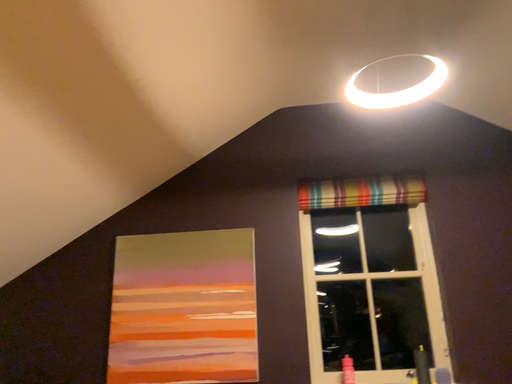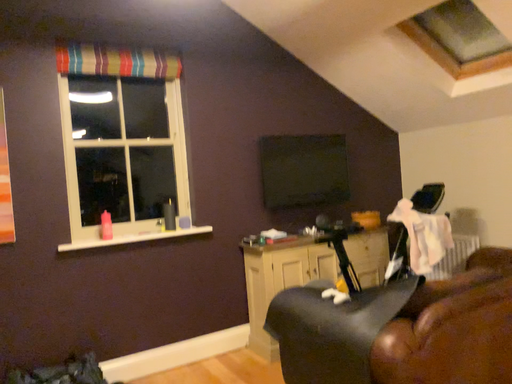
Question: Which way did the camera rotate in the video?

Choices:
 (A) rotated downward
 (B) rotated upward

Answer: (A)